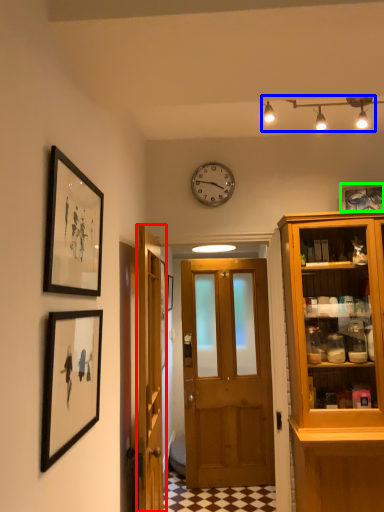
Question: Which is farther away from door (highlighted by a red box)? light fixture (highlighted by a blue box) or picture frame (highlighted by a green box)?

Choices:
 (A) light fixture
 (B) picture frame

Answer: (B)